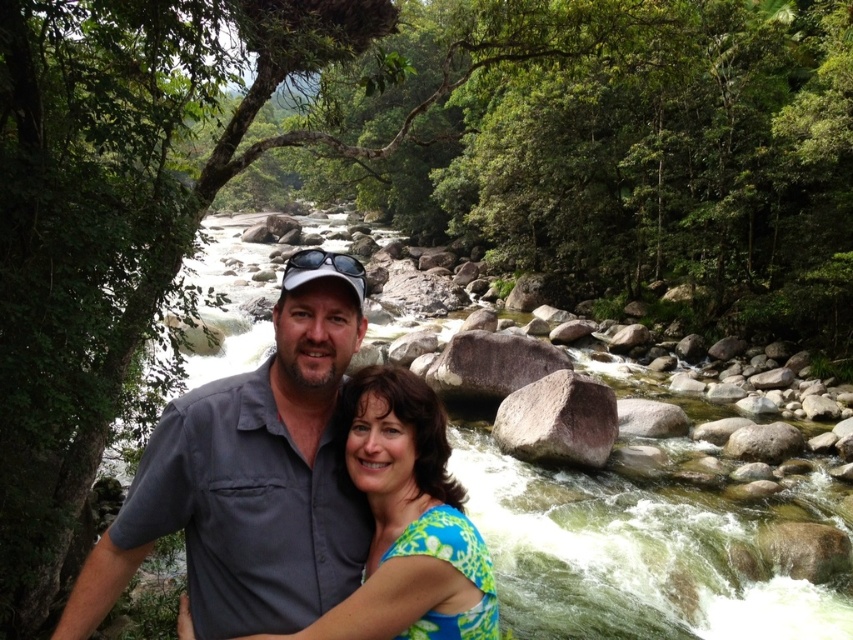
Is gray fabric shirt at center to the left of gray smooth rock at center-right from the viewer's perspective?

Correct, you'll find gray fabric shirt at center to the left of gray smooth rock at center-right.

Is point (297, 369) positioned after point (502, 410)?

No, (297, 369) is in front of (502, 410).

Where is `gray fabric shirt at center`? The height and width of the screenshot is (640, 853). gray fabric shirt at center is located at coordinates (250, 477).

Describe the element at coordinates (407, 522) in the screenshot. This screenshot has height=640, width=853. I see `green floral dress at center` at that location.

Can you confirm if green floral dress at center is bigger than smooth gray rock at center?

No.

Where is `green floral dress at center`? green floral dress at center is located at coordinates (407, 522).

Can you confirm if gray smooth rock at center-right is shorter than smooth gray rock at center?

No, gray smooth rock at center-right is not shorter than smooth gray rock at center.

Does gray smooth rock at center-right lie in front of smooth gray rock at center?

Yes.

You are a GUI agent. You are given a task and a screenshot of the screen. Output one action in this format:
    pyautogui.click(x=<x>, y=<y>)
    Task: Click on the gray smooth rock at center-right
    The width and height of the screenshot is (853, 640).
    Given the screenshot: What is the action you would take?
    pyautogui.click(x=558, y=420)

This screenshot has width=853, height=640. Find the location of `gray smooth rock at center-right`. gray smooth rock at center-right is located at coordinates (558, 420).